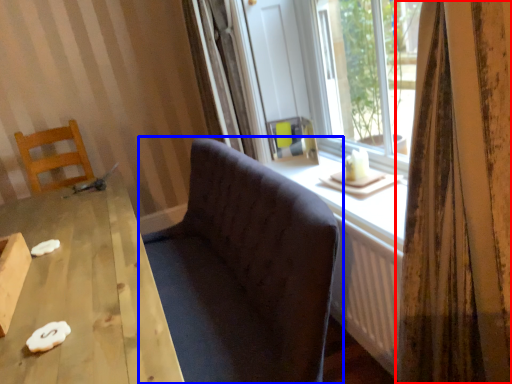
Question: Which object is closer to the camera taking this photo, curtain (highlighted by a red box) or studio couch (highlighted by a blue box)?

Choices:
 (A) curtain
 (B) studio couch

Answer: (A)